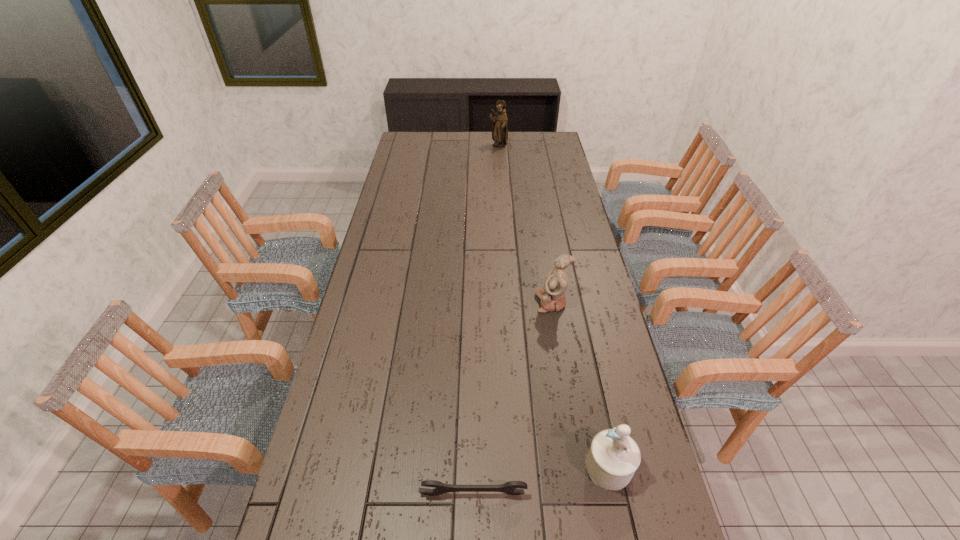
I want to click on vacant region located 0.350m at the beak of the third farthest object, so click(448, 467).

Find the location of a particular element. The height and width of the screenshot is (540, 960). free spot located 0.130m at the beak of the third farthest object is located at coordinates (535, 467).

Identify the location of vacant region located at the beak of the third farthest object. click(566, 467).

Find the location of `free location located 0.050m on the open ends of the wrench`. free location located 0.050m on the open ends of the wrench is located at coordinates (472, 518).

Identify the location of object that is at the far edge. This screenshot has height=540, width=960. (499, 123).

Locate an element on the screen. Image resolution: width=960 pixels, height=540 pixels. free spot at the far edge of the desktop is located at coordinates (524, 146).

Image resolution: width=960 pixels, height=540 pixels. Identify the location of blank space at the left edge. (378, 355).

The height and width of the screenshot is (540, 960). I want to click on free location at the right edge of the desktop, so click(x=549, y=246).

The image size is (960, 540). I want to click on blank area at the far left corner, so click(x=423, y=141).

The width and height of the screenshot is (960, 540). In order to click on free area in between the second farthest object and the leftmost figurine in this screenshot , I will do `click(525, 224)`.